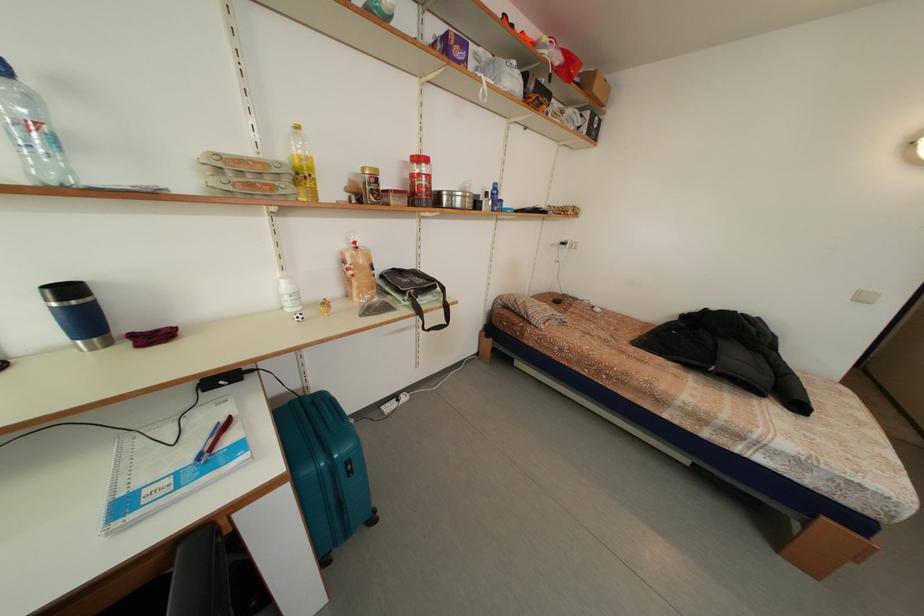
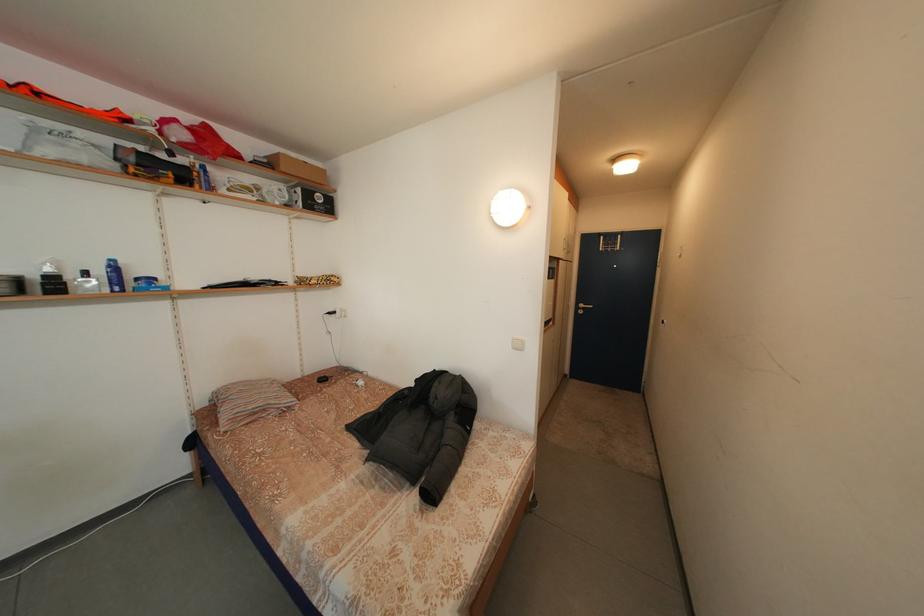
Find the pixel in the second image that matches [603,95] in the first image.

(292, 175)